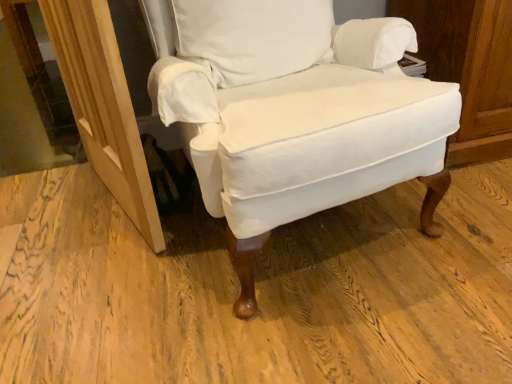
The width and height of the screenshot is (512, 384). I want to click on vacant area that is in front of wooden screen door at lower left, so click(x=111, y=281).